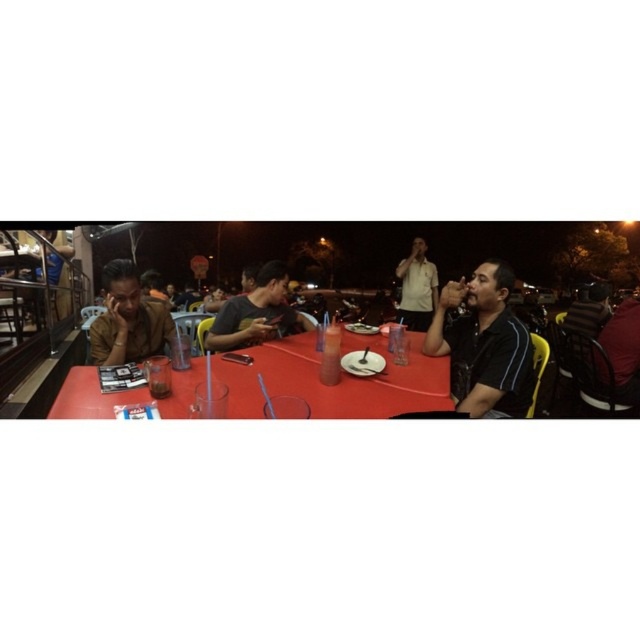
Question: Is dark gray fabric shirt at center bigger than dark red leather jacket at lower right?

Choices:
 (A) no
 (B) yes

Answer: (A)

Question: Which point appears farthest from the camera in this image?

Choices:
 (A) (294, 314)
 (B) (132, 339)
 (C) (426, 328)
 (D) (625, 396)

Answer: (C)

Question: Can you confirm if smooth plastic table at center is positioned above matte brown shirt at left?

Choices:
 (A) yes
 (B) no

Answer: (B)

Question: Does smooth plastic table at center appear on the left side of dark red leather jacket at lower right?

Choices:
 (A) yes
 (B) no

Answer: (A)

Question: Which point is farther from the camera taking this photo?

Choices:
 (A) (424, 323)
 (B) (445, 289)

Answer: (A)

Question: Which object is farther from the camera taking this photo?

Choices:
 (A) smooth plastic fork at center
 (B) matte brown shirt at left
 (C) white matte shirt at center
 (D) smooth plastic table at center

Answer: (C)